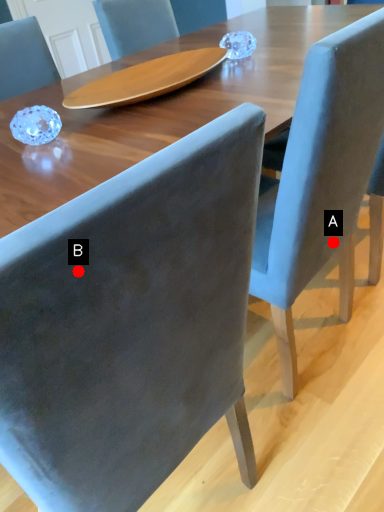
Question: Two points are circled on the image, labeled by A and B beside each circle. Which point is farther to the camera?

Choices:
 (A) A is further
 (B) B is further

Answer: (A)